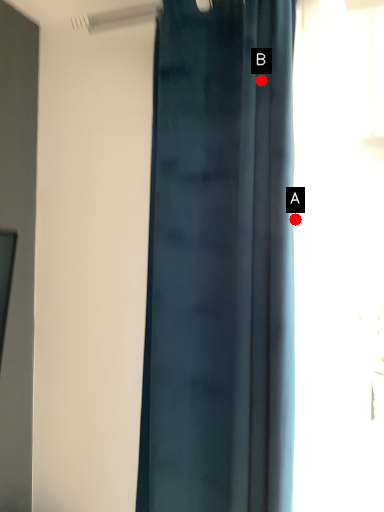
Question: Two points are circled on the image, labeled by A and B beside each circle. Which of the following is the closest to the observer?

Choices:
 (A) A is closer
 (B) B is closer

Answer: (A)